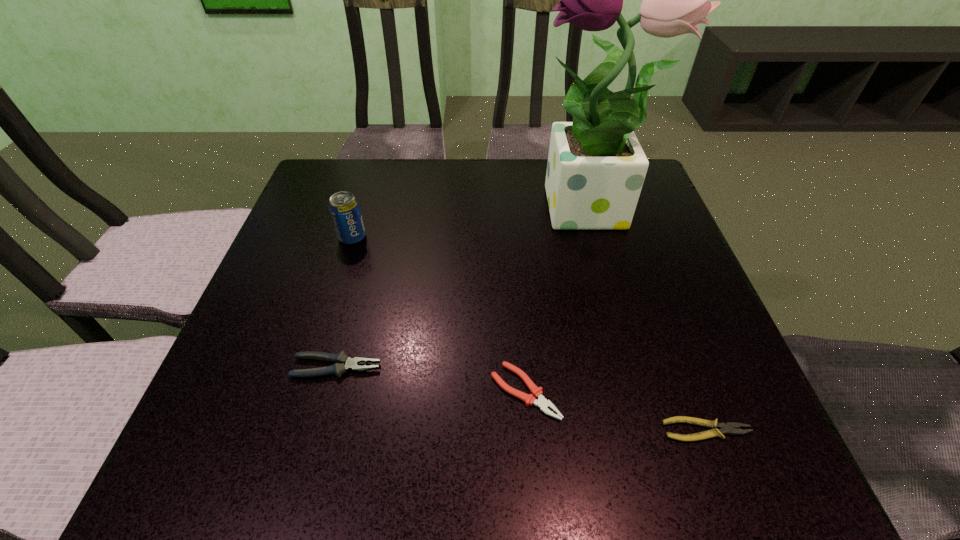
Find the location of a particular element. This screenshot has width=960, height=540. vacant space that satisfies the following two spatial constraints: 1. at the gripping part of the tallest pliers; 2. on the right side of the second tallest pliers is located at coordinates (330, 392).

This screenshot has height=540, width=960. In order to click on free region that satisfies the following two spatial constraints: 1. at the gripping part of the second shortest object; 2. on the right side of the tallest pliers in this screenshot , I will do `click(330, 392)`.

Locate an element on the screen. vacant space that satisfies the following two spatial constraints: 1. at the gripping part of the shortest object; 2. on the left side of the leftmost pliers is located at coordinates (321, 430).

Where is `vacant space that satisfies the following two spatial constraints: 1. at the gripping part of the tallest pliers; 2. on the back side of the shortest object`? The image size is (960, 540). vacant space that satisfies the following two spatial constraints: 1. at the gripping part of the tallest pliers; 2. on the back side of the shortest object is located at coordinates (321, 430).